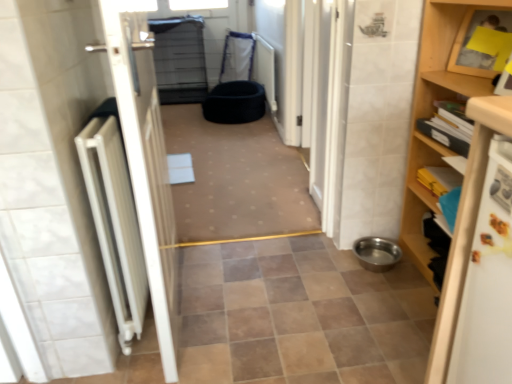
Where is `free space below metallic stainless steel bowl at lower right, the first toilet bowl in the front-to-back sequence (from a real-world perspective)`? This screenshot has width=512, height=384. free space below metallic stainless steel bowl at lower right, the first toilet bowl in the front-to-back sequence (from a real-world perspective) is located at coordinates (375, 266).